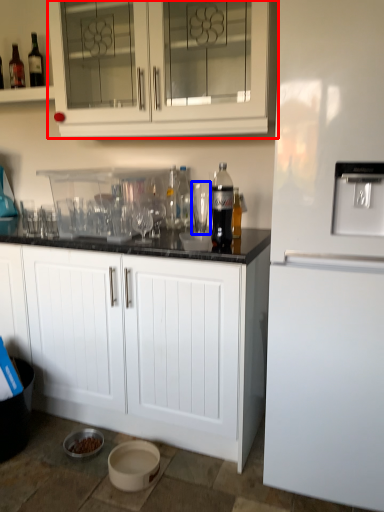
Question: Which of the following is the closest to the observer, cabinetry (highlighted by a red box) or shot glass (highlighted by a blue box)?

Choices:
 (A) cabinetry
 (B) shot glass

Answer: (A)